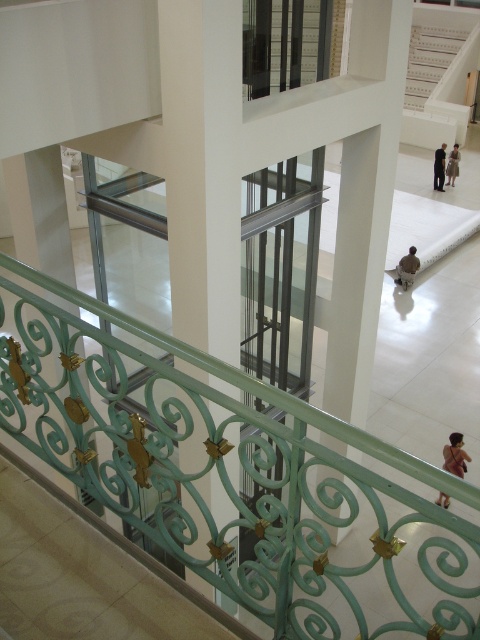
Between black fabric person at center and light brown leather jacket at center, which one appears on the left side from the viewer's perspective?

From the viewer's perspective, black fabric person at center appears more on the left side.

Does black fabric person at center have a smaller size compared to light brown leather jacket at center?

No, black fabric person at center is not smaller than light brown leather jacket at center.

Does point (442, 154) lie behind point (450, 154)?

No, it is not.

Where is `black fabric person at center`? The width and height of the screenshot is (480, 640). black fabric person at center is located at coordinates [440, 168].

Does white plastic stairs at upper center have a lesser height compared to brown fabric at lower right?

In fact, white plastic stairs at upper center may be taller than brown fabric at lower right.

Find the location of `white plastic stairs at upper center`. white plastic stairs at upper center is located at coordinates (429, 60).

I want to click on white plastic stairs at upper center, so click(429, 60).

Between point (408, 67) and point (442, 189), which one is positioned behind?

Positioned behind is point (408, 67).

The width and height of the screenshot is (480, 640). What do you see at coordinates (429, 60) in the screenshot?
I see `white plastic stairs at upper center` at bounding box center [429, 60].

Where is `white plastic stairs at upper center`? white plastic stairs at upper center is located at coordinates (429, 60).